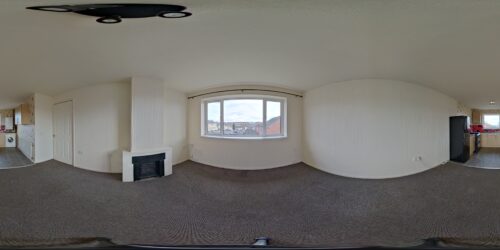
At what (x,y) coordinates should I click in order to perform the action: click on outlet on right wall. Please return your answer as a coordinate pair (x, y). Looking at the image, I should click on (417, 157).